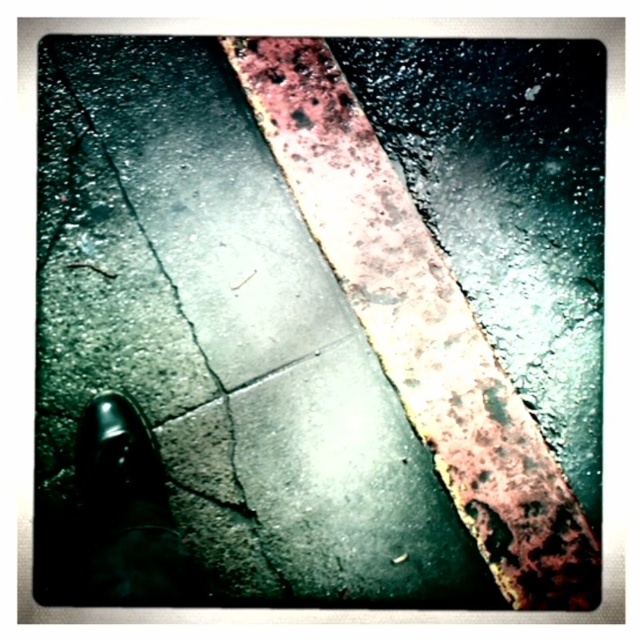
In the scene shown: You are standing at the center of the pavement and see the dark gray concrete crack at lower left. What is the direction of the crack relative to your position?

The dark gray concrete crack at lower left is located at point (140, 275), which is to the lower left direction from your current position at the center of the pavement.

You are standing at the camera position and want to pick up an item located at point (428, 230). Can you reach it without moving your feet?

The point (428, 230) is 1.74 meters away from the camera, so you can reach it without moving your feet if your arm can extend that far.

You are standing on the pavement and see the dark gray concrete crack at lower left and the rusty metal curb at upper center. Which object is closer to your feet?

The rusty metal curb at upper center is closer to your feet because the dark gray concrete crack at lower left is above it, meaning the curb is positioned lower and nearer to the observer.